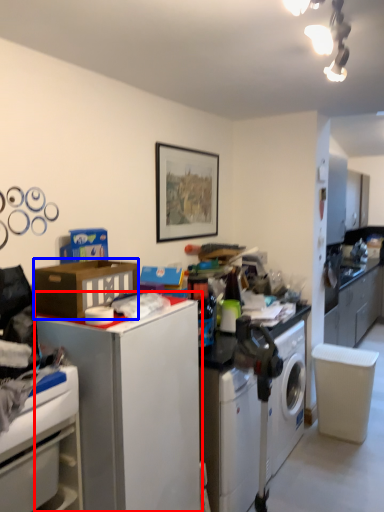
Question: Which point is further to the camera, file cabinet (highlighted by a red box) or cardboard box (highlighted by a blue box)?

Choices:
 (A) file cabinet
 (B) cardboard box

Answer: (B)